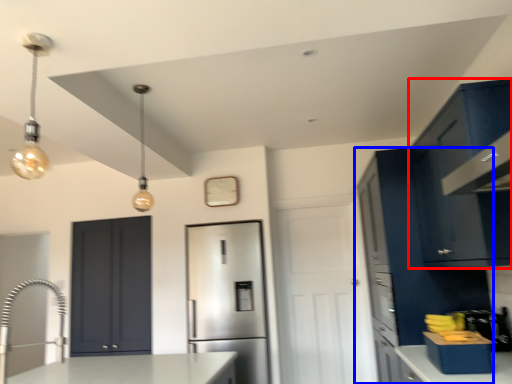
Question: Which object appears farthest to the camera in this image, cabinetry (highlighted by a red box) or cabinetry (highlighted by a blue box)?

Choices:
 (A) cabinetry
 (B) cabinetry

Answer: (B)